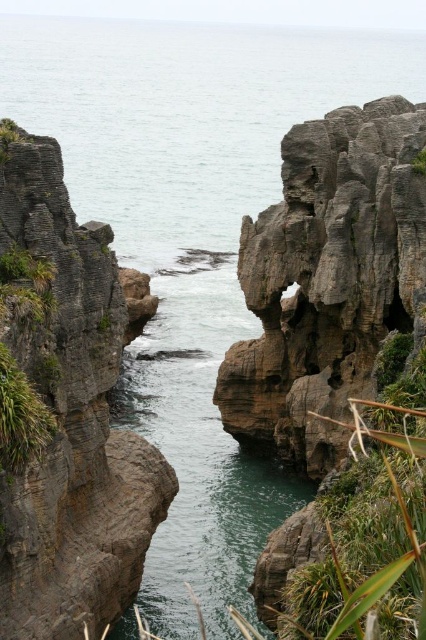
You are a geologist studying the coastal formations. You need to determine the position of the rough gray rock at center relative to the cliffs. Is it closer to the top or the bottom of the cliffs?

The rough gray rock at center is located at point coordinates that place it closer to the bottom of the cliffs since its y coordinate 0.768 is closer to 1.0 which represents the bottom of the image.